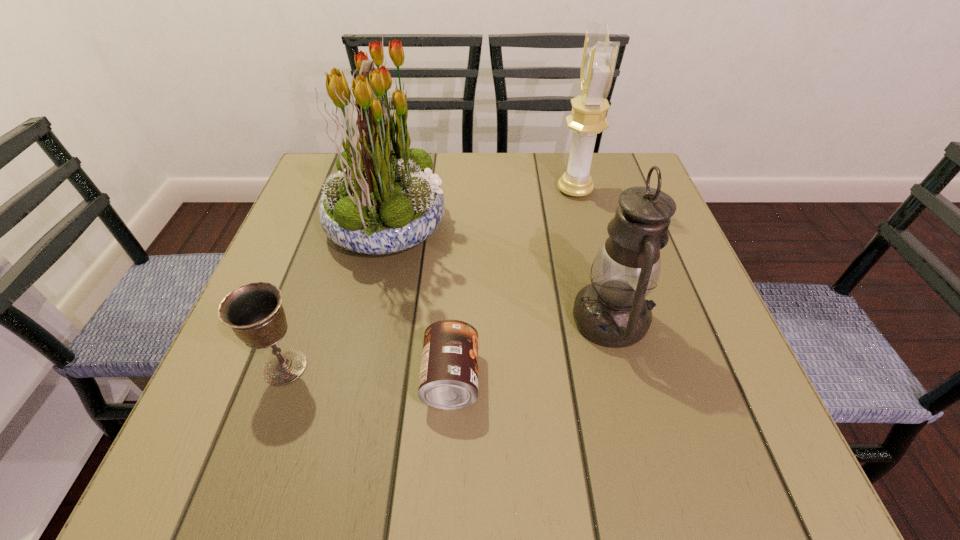
The image size is (960, 540). I want to click on flower arrangement, so click(384, 199).

The image size is (960, 540). Find the location of `award`. award is located at coordinates (588, 117).

At what (x,y) coordinates should I click in order to perform the action: click on oil lamp. Please return your answer as a coordinate pair (x, y). Looking at the image, I should click on (612, 311).

I want to click on chalice, so click(x=254, y=312).

The height and width of the screenshot is (540, 960). I want to click on the shortest object, so click(448, 380).

Find the location of a particular element. vacant space situated on the front-facing side of the flower arrangement is located at coordinates (567, 225).

You are a GUI agent. You are given a task and a screenshot of the screen. Output one action in this format:
    pyautogui.click(x=<x>, y=<y>)
    Task: Click on the free space located on the front-facing side of the award
    
    Given the screenshot: What is the action you would take?
    pyautogui.click(x=426, y=190)

You are a GUI agent. You are given a task and a screenshot of the screen. Output one action in this format:
    pyautogui.click(x=<x>, y=<y>)
    Task: Click on the free space located 0.240m on the front-facing side of the award
    
    Given the screenshot: What is the action you would take?
    click(x=459, y=190)

I want to click on vacant area situated 0.300m on the front-facing side of the award, so click(x=435, y=190).

At what (x,y) coordinates should I click in order to perform the action: click on vacant space located on the left of the oil lamp. Please return your answer as a coordinate pair (x, y). The image size is (960, 540). Looking at the image, I should click on (494, 320).